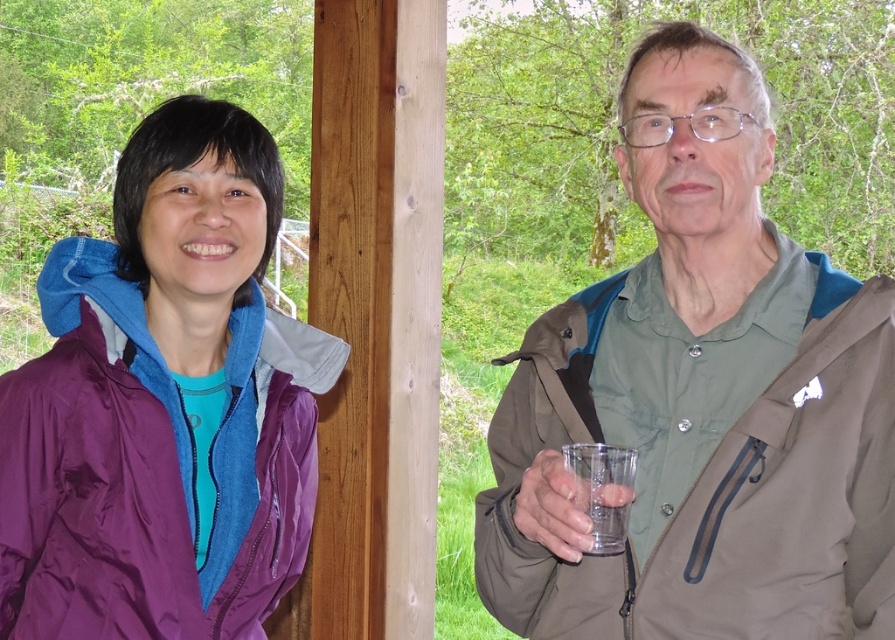
Find the location of a particular element. This screenshot has width=895, height=640. matte green shirt at center is located at coordinates tap(701, 400).

Can you confirm if matte green shirt at center is wider than transparent plastic cup at right?

Yes, matte green shirt at center is wider than transparent plastic cup at right.

Where is `matte green shirt at center`? The image size is (895, 640). matte green shirt at center is located at coordinates (701, 400).

Does matte green shirt at center have a lesser width compared to purple nylon jacket at left?

No.

Does matte green shirt at center have a lesser height compared to purple nylon jacket at left?

No, matte green shirt at center is not shorter than purple nylon jacket at left.

Is point (723, 628) behind point (240, 444)?

That is False.

Locate an element on the screen. matte green shirt at center is located at coordinates (701, 400).

Can you confirm if purple nylon jacket at left is thinner than transparent plastic cup at right?

No.

Consider the image. Does purple nylon jacket at left lie in front of transparent plastic cup at right?

No, it is behind transparent plastic cup at right.

What are the coordinates of `purple nylon jacket at left` in the screenshot? It's located at (150, 468).

Where is `purple nylon jacket at left`? The image size is (895, 640). purple nylon jacket at left is located at coordinates (150, 468).